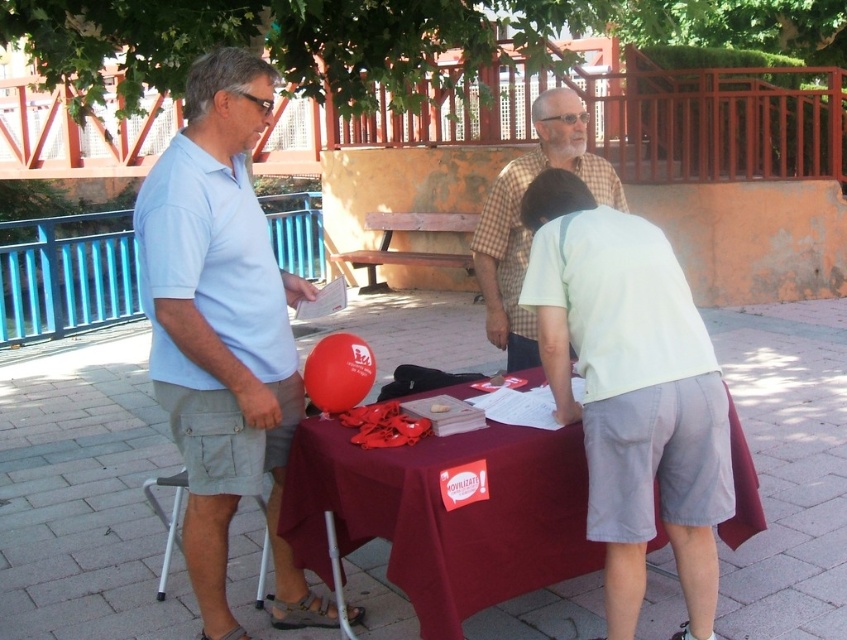
Question: Can you confirm if checkered fabric shirt at center is positioned to the left of brown wooden bench at center?

Choices:
 (A) yes
 (B) no

Answer: (B)

Question: Based on their relative distances, which object is farther from the brown wooden bench at center?

Choices:
 (A) maroon fabric table at center
 (B) light blue cotton shirt at left

Answer: (A)

Question: Is checkered fabric shirt at center wider than light gray plastic stool at lower left?

Choices:
 (A) yes
 (B) no

Answer: (A)

Question: Where is maroon fabric table at center located in relation to checkered fabric shirt at center in the image?

Choices:
 (A) below
 (B) above

Answer: (A)

Question: Which object is closer to the camera taking this photo?

Choices:
 (A) checkered fabric shirt at center
 (B) light gray plastic stool at lower left
 (C) maroon fabric table at center

Answer: (C)

Question: Which of these objects is positioned closest to the light blue cotton shirt at left?

Choices:
 (A) maroon fabric table at center
 (B) light gray plastic stool at lower left
 (C) brown wooden bench at center

Answer: (A)